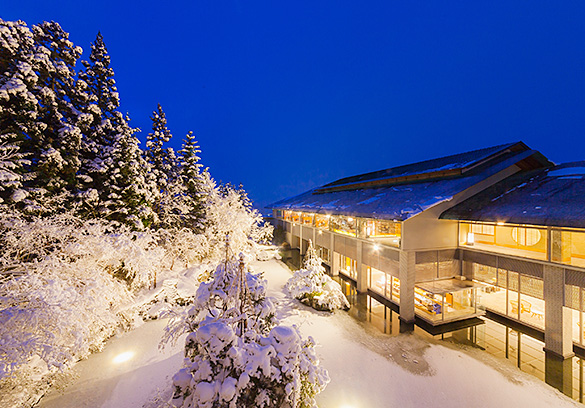
Find the location of a particular element. The image size is (585, 408). middle floor is located at coordinates (522, 296).